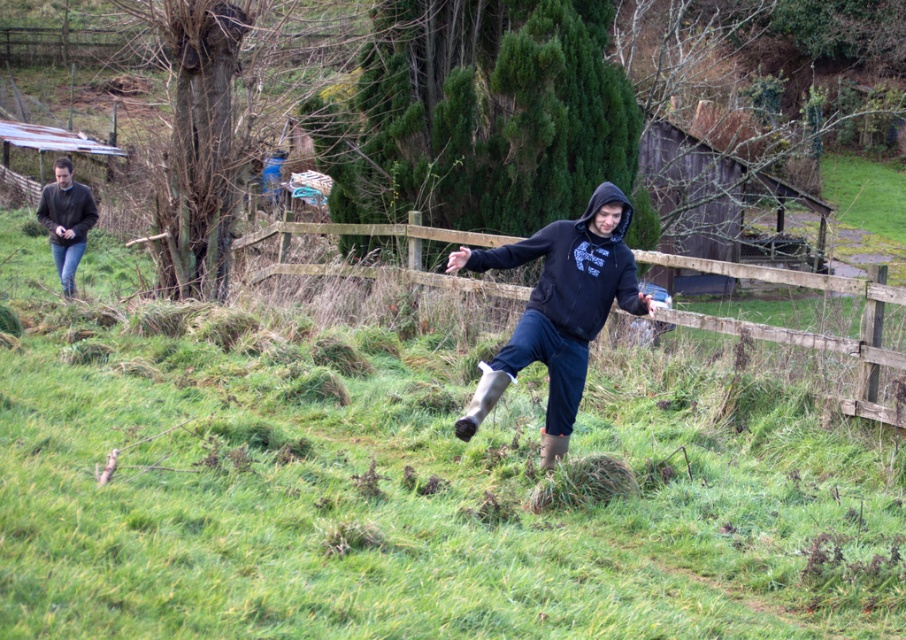
You are a drone operator trying to capture a photo of the black matte hoodie at center. The drone is currently at the origin point. What are the coordinates you need to adjust the drone to in order to take the photo?

The coordinates to adjust the drone to are point (558,308) to capture the black matte hoodie at center.

You are a photographer trying to capture the black hoodie at center and the green grassy at center in a single shot. Which object should you focus on first if you want to ensure both are in frame without moving the camera?

You should focus on the black hoodie at center first because it is larger than the green grassy at center, making it easier to frame initially.

You are a photographer trying to capture both the black hoodie at center and the dark gray hoodie at left in a single shot. Based on their positions, which one would appear closer to the camera in the photo?

The black hoodie at center appears closer to the camera because it is positioned below the dark gray hoodie at left, indicating it is in the foreground.